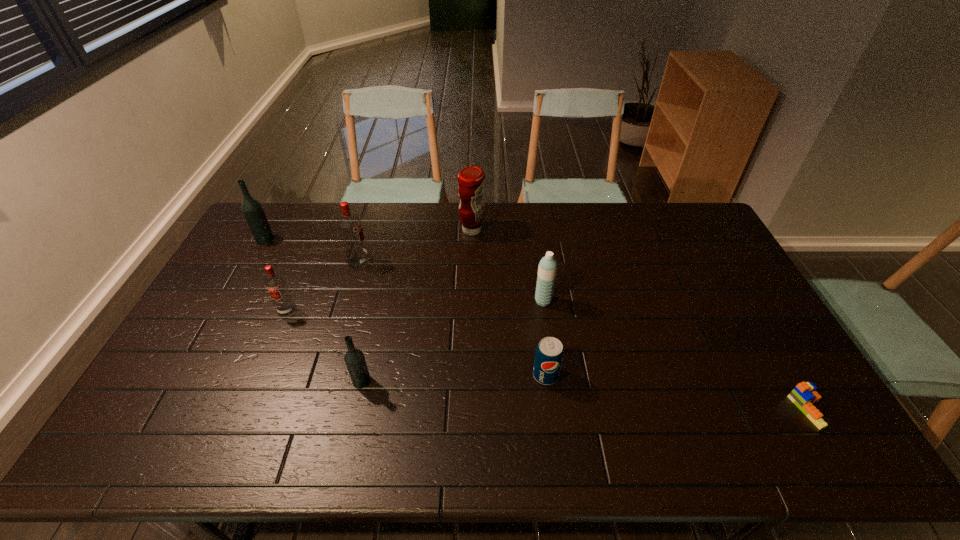
The width and height of the screenshot is (960, 540). What are the coordinates of `vacant space that is in between the nearest vodka and the condiment` in the screenshot? It's located at (417, 306).

At what (x,y) coordinates should I click in order to perform the action: click on free point between the right black vodka and the blue pop. Please return your answer as a coordinate pair (x, y). This screenshot has width=960, height=540. Looking at the image, I should click on (454, 378).

Find the location of a particular element. This screenshot has height=540, width=960. vacant area that lies between the blue water bottle and the rightmost vodka is located at coordinates (452, 341).

Point out which object is positioned as the fifth nearest to the second object from left to right. Please provide its 2D coordinates. Your answer should be formatted as a tuple, i.e. [(x, y)], where the tuple contains the x and y coordinates of a point satisfying the conditions above.

[(549, 354)]

Locate an element on the screen. The image size is (960, 540). the seventh closest object to the blue water bottle is located at coordinates (252, 209).

Locate which vodka ranks second in proximity to the second vodka from left to right. Please provide its 2D coordinates. Your answer should be formatted as a tuple, i.e. [(x, y)], where the tuple contains the x and y coordinates of a point satisfying the conditions above.

[(354, 358)]

What are the coordinates of `vodka identified as the third closest to the smaller red vodka` in the screenshot? It's located at (252, 209).

At what (x,y) coordinates should I click in order to perform the action: click on free location that satisfies the following two spatial constraints: 1. on the front label of the right red vodka; 2. on the left side of the nearer black vodka. Please return your answer as a coordinate pair (x, y). The height and width of the screenshot is (540, 960). Looking at the image, I should click on (324, 381).

Image resolution: width=960 pixels, height=540 pixels. What are the coordinates of `free point that satisfies the following two spatial constraints: 1. on the front label of the rightmost vodka; 2. on the left side of the left red vodka` in the screenshot? It's located at (257, 381).

Find the location of a particular element. This screenshot has height=540, width=960. free space that satisfies the following two spatial constraints: 1. on the back side of the pop; 2. on the left side of the nearest vodka is located at coordinates (363, 375).